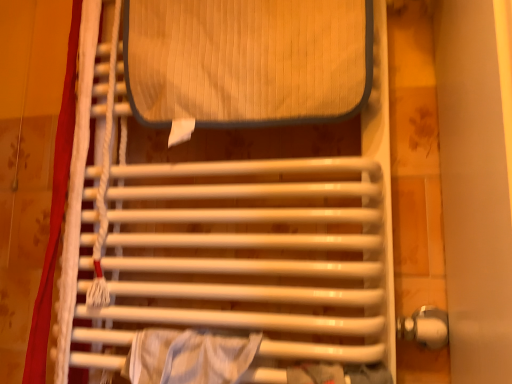
Question: From a real-world perspective, is white fabric curtain at left positioned above or below white glossy towel rack at center?

Choices:
 (A) below
 (B) above

Answer: (A)

Question: Considering the positions of white fabric curtain at left and white glossy towel rack at center in the image, is white fabric curtain at left wider or thinner than white glossy towel rack at center?

Choices:
 (A) thin
 (B) wide

Answer: (A)

Question: Considering their positions, is white fabric curtain at left located in front of or behind white glossy towel rack at center?

Choices:
 (A) behind
 (B) front

Answer: (A)

Question: In terms of height, does white glossy towel rack at center look taller or shorter compared to white fabric curtain at left?

Choices:
 (A) short
 (B) tall

Answer: (A)

Question: Is white glossy towel rack at center situated inside white fabric curtain at left or outside?

Choices:
 (A) inside
 (B) outside

Answer: (B)

Question: Is point (211, 299) positioned closer to the camera than point (46, 281)?

Choices:
 (A) closer
 (B) farther

Answer: (A)

Question: Considering the positions of white glossy towel rack at center and white fabric curtain at left in the image, is white glossy towel rack at center wider or thinner than white fabric curtain at left?

Choices:
 (A) wide
 (B) thin

Answer: (A)